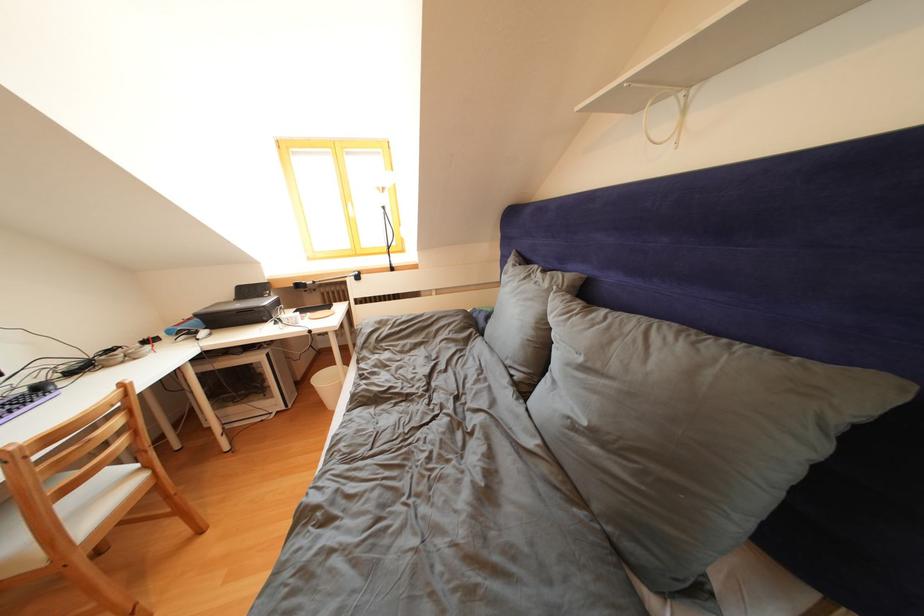
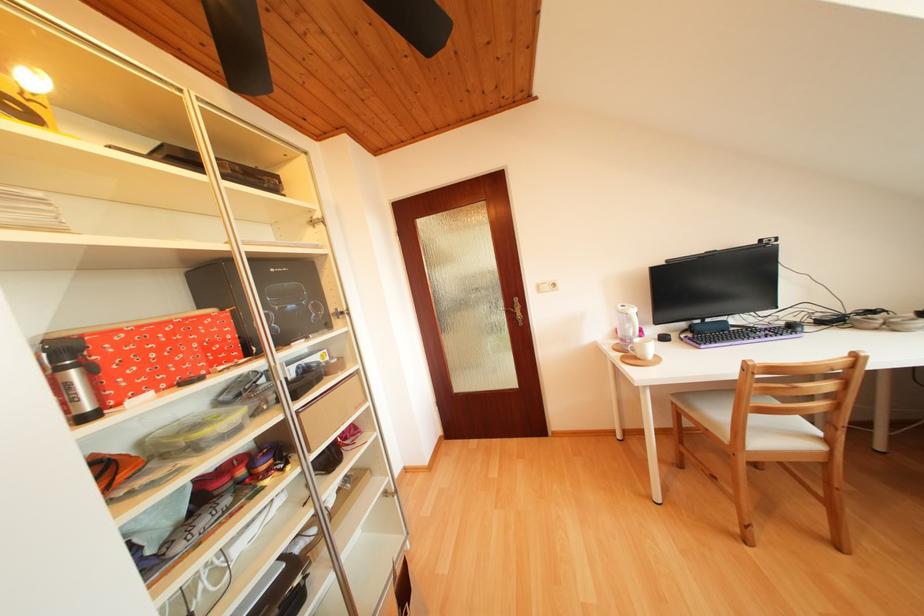
In the second image, find the point that corresponds to point (49, 394) in the first image.

(799, 331)